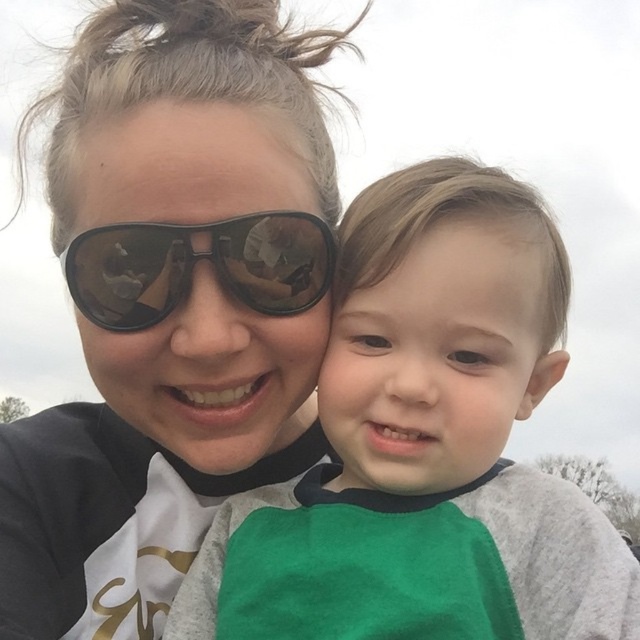
You are a photographer trying to capture a candid shot of the two people in the scene. You notice the matte black sunglasses at upper center and the matte black goggles at center. Which object is positioned closer to the left side of the frame?

The matte black sunglasses at upper center is positioned to the left of the matte black goggles at center, so it is closer to the left side of the frame.

You are a photographer trying to capture a candid shot of the green fabric shirt at center and the matte black goggles at center. Since you want to frame both subjects in the same shot, which direction should you move your camera to ensure both are visible?

Since the green fabric shirt at center is to the right of matte black goggles at center, you should move your camera slightly to the right to include both the green fabric shirt at center and the matte black goggles at center in the frame.

You are standing in the scene and want to walk towards both the point at coordinates (262, 108) and the point at coordinates (241, 289). Which point will you reach first?

You will reach the point at coordinates (262, 108) first because it is closer to you than the point at coordinates (241, 289).